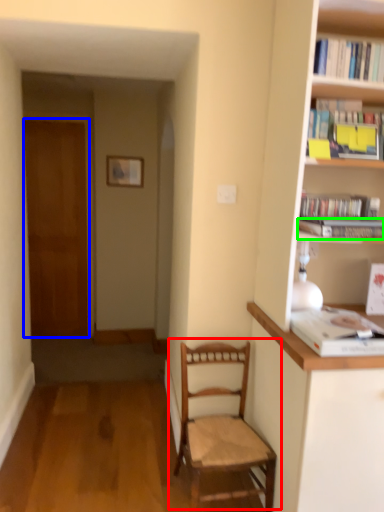
Question: Which object is positioned farthest from chair (highlighted by a red box)? Select from door (highlighted by a blue box) and book (highlighted by a green box).

Choices:
 (A) door
 (B) book

Answer: (A)